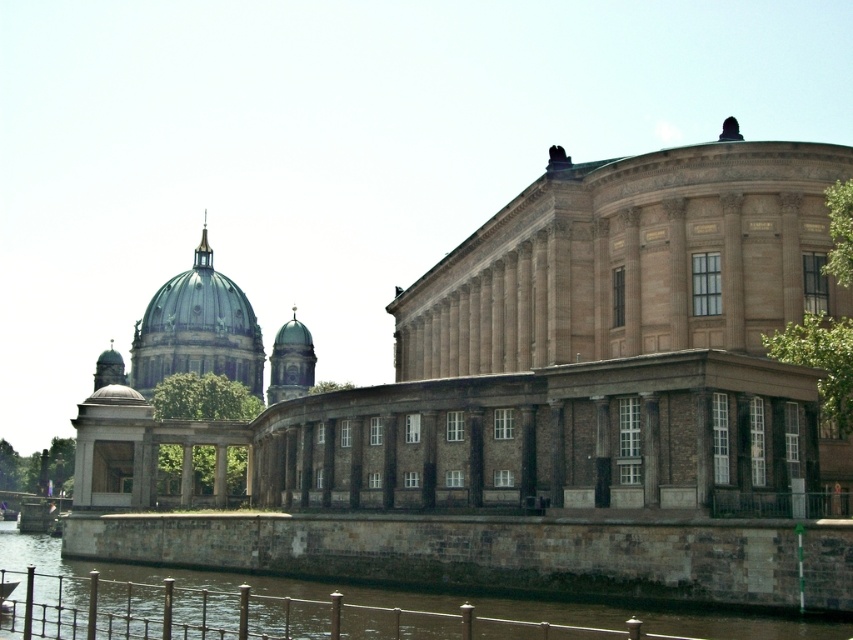
Measure the distance between brown stone building at center and brown stone wall at lower left.

The distance of brown stone building at center from brown stone wall at lower left is 62.63 feet.

What do you see at coordinates (548, 358) in the screenshot? The image size is (853, 640). I see `brown stone building at center` at bounding box center [548, 358].

Is point (490, 289) positioned in front of point (656, 620)?

No, it is behind (656, 620).

Find the location of `brown stone building at center`. brown stone building at center is located at coordinates (548, 358).